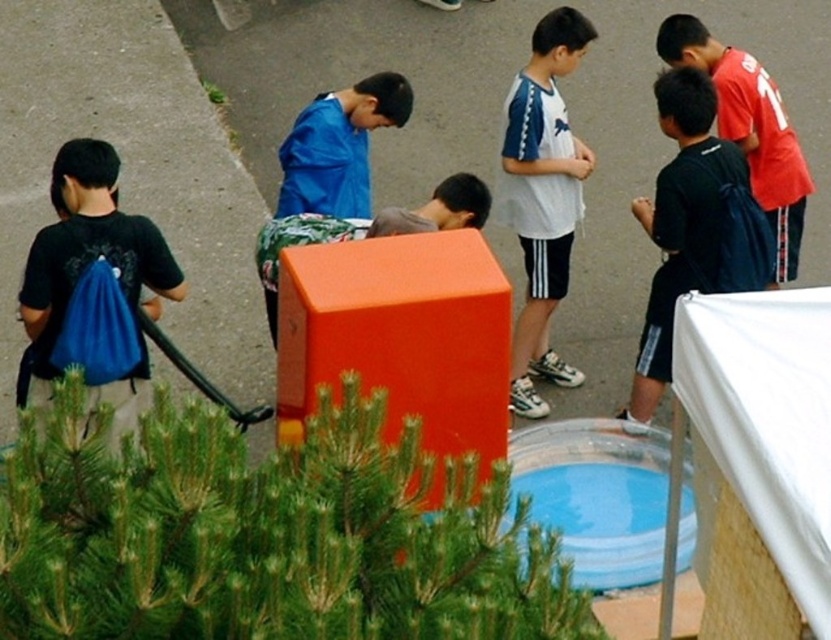
Question: Which is nearer to the white matte shirt at center?

Choices:
 (A) dark blue backpack at right
 (B) red jersey at upper right
 (C) blue fabric backpack at left
 (D) blue plastic pool at lower center

Answer: (A)

Question: Can you confirm if blue fabric backpack at left is positioned above red jersey at upper right?

Choices:
 (A) yes
 (B) no

Answer: (B)

Question: Estimate the real-world distances between objects in this image. Which object is farther from the white matte shirt at center?

Choices:
 (A) red jersey at upper right
 (B) blue plastic pool at lower center
 (C) blue fabric backpack at left
 (D) dark blue backpack at right

Answer: (C)

Question: Which object is positioned closest to the white matte shirt at center?

Choices:
 (A) blue plastic pool at lower center
 (B) dark blue backpack at right
 (C) blue fabric backpack at left

Answer: (B)

Question: Does dark blue backpack at right appear under blue plastic pool at lower center?

Choices:
 (A) no
 (B) yes

Answer: (A)

Question: Is dark blue backpack at right above red jersey at upper right?

Choices:
 (A) no
 (B) yes

Answer: (A)